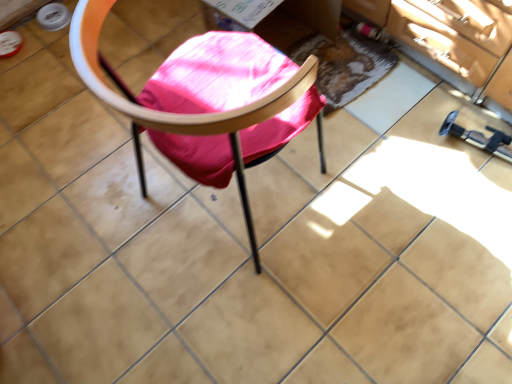
Where is `free space in front of wooden chair at center`? The image size is (512, 384). free space in front of wooden chair at center is located at coordinates (252, 316).